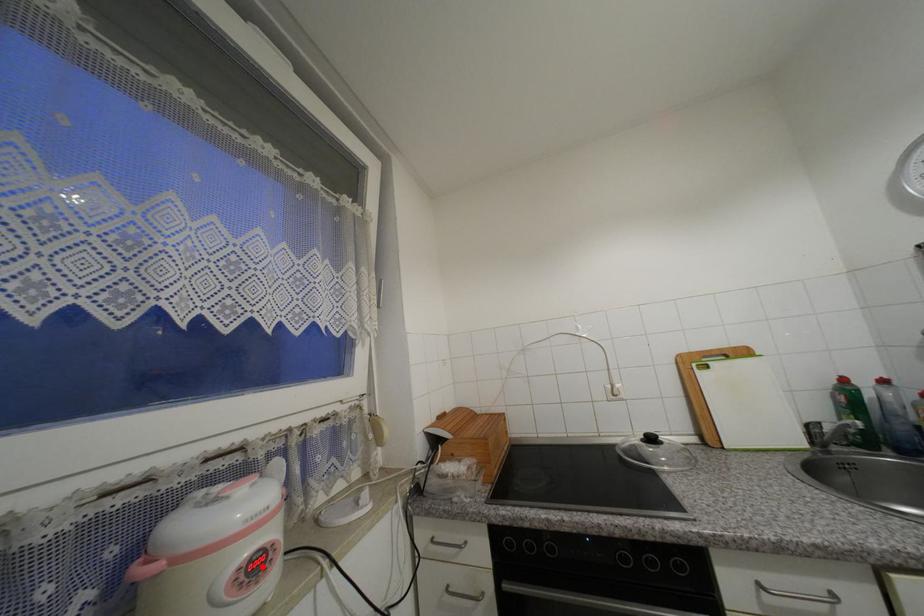
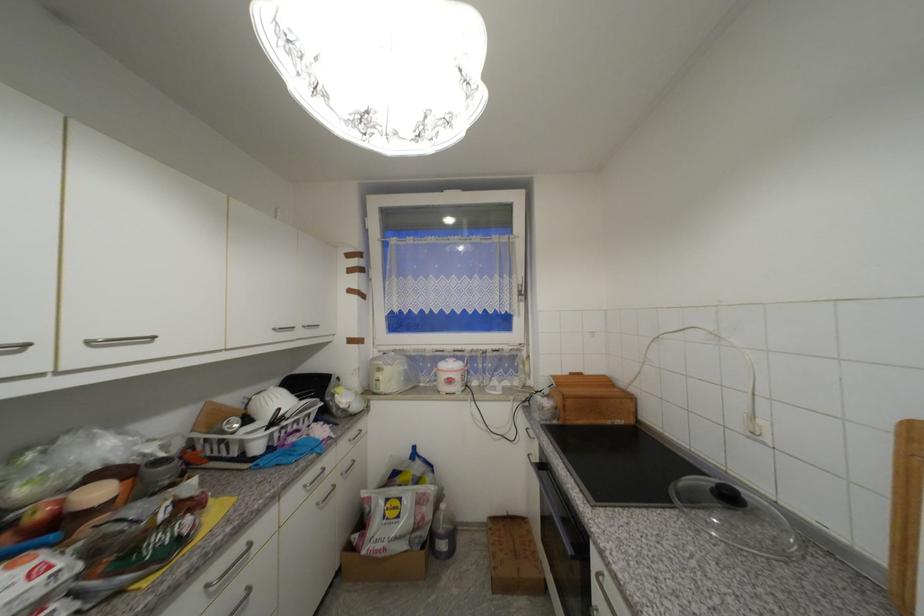
Question: I am providing you with two images of the same scene from different viewpoints. Image1 has a red point marked. In image2, the corresponding 3D location appears at what relative position? Reply with the corresponding letter.

Choices:
 (A) Closer
 (B) Farther

Answer: (B)